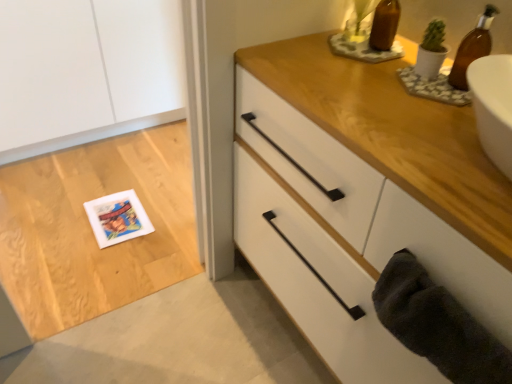
Locate an element on the screen. vacant space situated above white matte postcard at lower left (from a real-world perspective) is located at coordinates (117, 216).